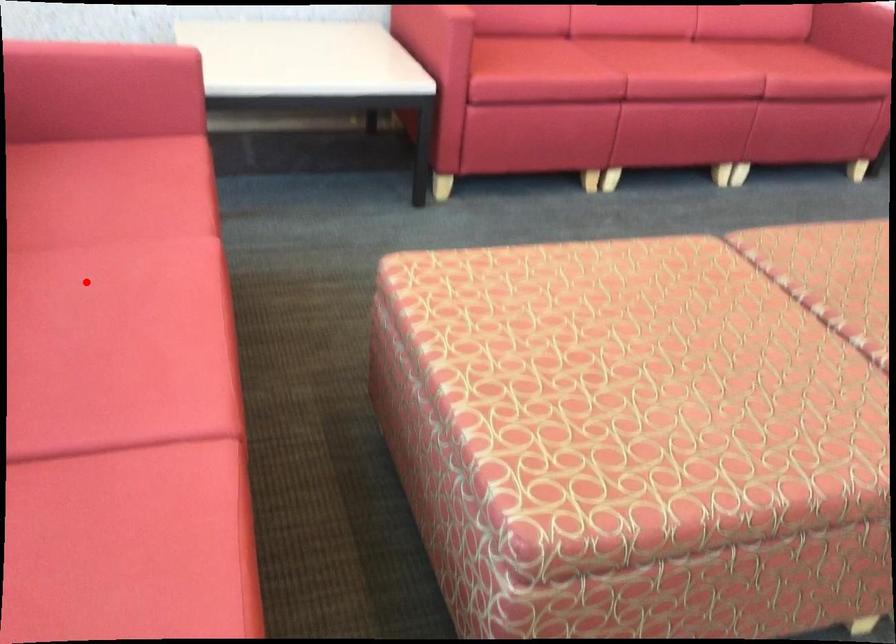
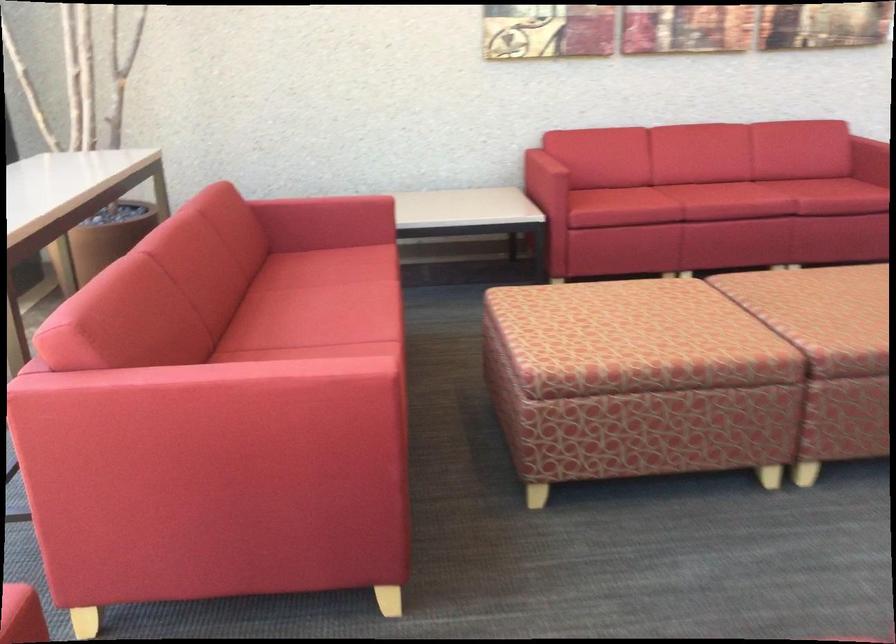
Where in the second image is the point corresponding to the highlighted location from the first image?

(334, 295)